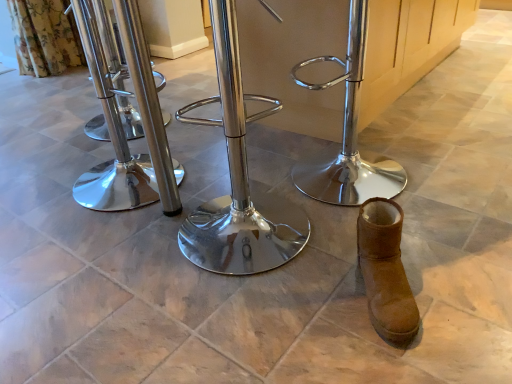
The width and height of the screenshot is (512, 384). Identify the location of vacant area located to the right-hand side of brown suede boot at lower right. (451, 289).